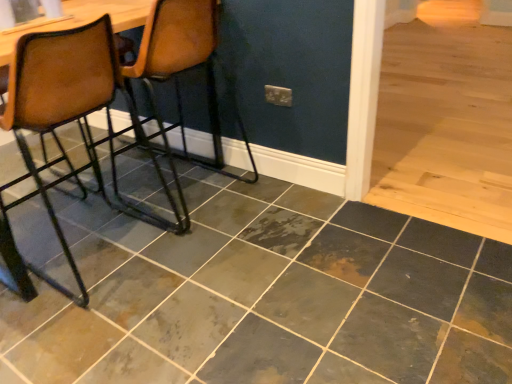
Question: Is brown leather chair at left, which is counted as the 2th chair, starting from the left, smaller than marbled slate tile at center?

Choices:
 (A) yes
 (B) no

Answer: (B)

Question: From a real-world perspective, is brown leather chair at left, the first chair from the right, over marbled slate tile at center?

Choices:
 (A) yes
 (B) no

Answer: (A)

Question: Can you confirm if brown leather chair at left, the first chair from the right, is shorter than marbled slate tile at center?

Choices:
 (A) yes
 (B) no

Answer: (B)

Question: Is brown leather chair at left, the first chair from the right, positioned behind marbled slate tile at center?

Choices:
 (A) yes
 (B) no

Answer: (A)

Question: Can you confirm if brown leather chair at left, the first chair from the right, is taller than marbled slate tile at center?

Choices:
 (A) no
 (B) yes

Answer: (B)

Question: From the image's perspective, relative to marbled slate tile at center, is brown leather chair at left, which is counted as the 2th chair, starting from the left, above or below?

Choices:
 (A) below
 (B) above

Answer: (B)

Question: Considering their positions, is brown leather chair at left, which is counted as the 2th chair, starting from the left, located in front of or behind marbled slate tile at center?

Choices:
 (A) behind
 (B) front

Answer: (A)

Question: Choose the correct answer: Is brown leather chair at left, the first chair from the right, inside marbled slate tile at center or outside it?

Choices:
 (A) outside
 (B) inside

Answer: (A)

Question: From a real-world perspective, is brown leather chair at left, the first chair from the right, physically located above or below marbled slate tile at center?

Choices:
 (A) above
 (B) below

Answer: (A)

Question: Based on their sizes in the image, would you say brown leather chair at left, arranged as the 2th chair when viewed from the right, is bigger or smaller than brown leather chair at left, which is counted as the 2th chair, starting from the left?

Choices:
 (A) small
 (B) big

Answer: (B)

Question: Considering the relative positions of brown leather chair at left, arranged as the 2th chair when viewed from the right, and brown leather chair at left, which is counted as the 2th chair, starting from the left, in the image provided, is brown leather chair at left, arranged as the 2th chair when viewed from the right, to the left or to the right of brown leather chair at left, which is counted as the 2th chair, starting from the left,?

Choices:
 (A) left
 (B) right

Answer: (A)

Question: Considering their positions, is brown leather chair at left, arranged as the 2th chair when viewed from the right, located in front of or behind brown leather chair at left, which is counted as the 2th chair, starting from the left?

Choices:
 (A) behind
 (B) front

Answer: (B)

Question: In terms of width, does brown leather chair at left, which is counted as the 1th chair, starting from the left, look wider or thinner when compared to brown leather chair at left, the first chair from the right?

Choices:
 (A) thin
 (B) wide

Answer: (B)

Question: From the image's perspective, relative to brown leather chair at left, which is counted as the 1th chair, starting from the left, is marbled slate tile at center above or below?

Choices:
 (A) below
 (B) above

Answer: (A)

Question: Is marbled slate tile at center in front of or behind brown leather chair at left, arranged as the 2th chair when viewed from the right, in the image?

Choices:
 (A) behind
 (B) front

Answer: (B)